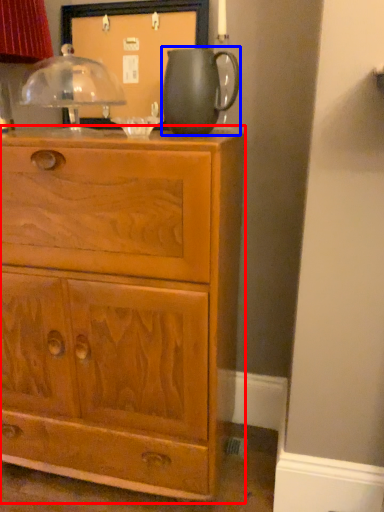
Question: Which of the following is the closest to the observer, chest of drawers (highlighted by a red box) or jug (highlighted by a blue box)?

Choices:
 (A) chest of drawers
 (B) jug

Answer: (A)